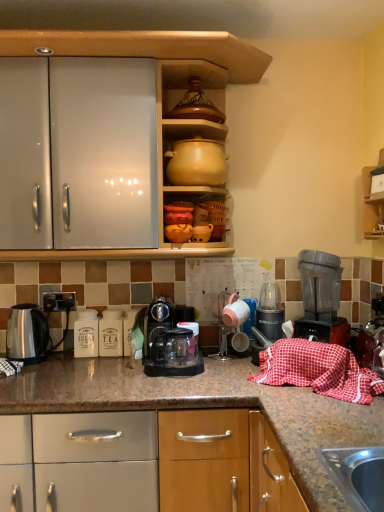
Question: Is red checkered cloth at lower right thinner than transparent plastic coffee maker at center, the 2th kitchen appliance in the left-to-right sequence?

Choices:
 (A) no
 (B) yes

Answer: (B)

Question: From the image's perspective, is red checkered cloth at lower right on transparent plastic coffee maker at center, the 2th kitchen appliance in the left-to-right sequence?

Choices:
 (A) yes
 (B) no

Answer: (B)

Question: Is red checkered cloth at lower right shorter than transparent plastic coffee maker at center, the second kitchen appliance when ordered from right to left?

Choices:
 (A) yes
 (B) no

Answer: (A)

Question: Does red checkered cloth at lower right turn towards transparent plastic coffee maker at center, the second kitchen appliance when ordered from right to left?

Choices:
 (A) no
 (B) yes

Answer: (A)

Question: From a real-world perspective, is red checkered cloth at lower right located higher than transparent plastic coffee maker at center, the second kitchen appliance when ordered from right to left?

Choices:
 (A) no
 (B) yes

Answer: (A)

Question: Would you say matte yellow clay pot at upper center is inside or outside black plastic electric outlet at lower left?

Choices:
 (A) inside
 (B) outside

Answer: (B)

Question: Is matte yellow clay pot at upper center taller or shorter than black plastic electric outlet at lower left?

Choices:
 (A) tall
 (B) short

Answer: (A)

Question: Is matte yellow clay pot at upper center wider or thinner than black plastic electric outlet at lower left?

Choices:
 (A) wide
 (B) thin

Answer: (A)

Question: Is point (216, 169) closer or farther from the camera than point (54, 309)?

Choices:
 (A) closer
 (B) farther

Answer: (A)

Question: Is metallic plastic blender at center, which ranks as the 3th kitchen appliance in left-to-right order, in front of or behind transparent plastic blender at right in the image?

Choices:
 (A) behind
 (B) front

Answer: (A)

Question: Is metallic plastic blender at center, which is the 1th kitchen appliance from right to left, situated inside transparent plastic blender at right or outside?

Choices:
 (A) inside
 (B) outside

Answer: (B)

Question: From a real-world perspective, is metallic plastic blender at center, which is the 1th kitchen appliance from right to left, physically located above or below transparent plastic blender at right?

Choices:
 (A) below
 (B) above

Answer: (A)

Question: From the image's perspective, is metallic plastic blender at center, which ranks as the 3th kitchen appliance in left-to-right order, located above or below transparent plastic blender at right?

Choices:
 (A) above
 (B) below

Answer: (B)

Question: From the image's perspective, is transparent plastic coffee maker at center, the second kitchen appliance when ordered from right to left, above or below black plastic electric outlet at lower left?

Choices:
 (A) below
 (B) above

Answer: (A)

Question: Would you say transparent plastic coffee maker at center, the 2th kitchen appliance in the left-to-right sequence, is to the left or to the right of black plastic electric outlet at lower left in the picture?

Choices:
 (A) right
 (B) left

Answer: (A)